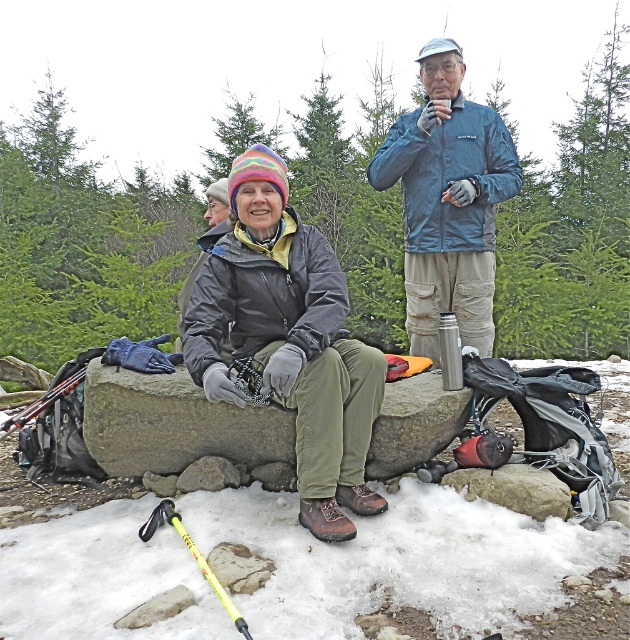
Question: Can you confirm if blue textured jacket at upper center is bigger than gray stone boulder at center?

Choices:
 (A) yes
 (B) no

Answer: (A)

Question: Which point is farther to the camera?

Choices:
 (A) blue textured jacket at upper center
 (B) gray stone boulder at center
 (C) matte black jacket at center

Answer: (A)

Question: From the image, what is the correct spatial relationship of matte black jacket at center in relation to blue textured jacket at upper center?

Choices:
 (A) left
 (B) right

Answer: (A)

Question: Which object is closer to the camera taking this photo?

Choices:
 (A) blue textured jacket at upper center
 (B) matte black jacket at center
 (C) gray stone boulder at center

Answer: (B)

Question: Which point is closer to the camera?

Choices:
 (A) (486, 166)
 (B) (459, 97)
 (C) (432, 372)

Answer: (C)

Question: Is matte black jacket at center to the left of blue textured jacket at upper center from the viewer's perspective?

Choices:
 (A) yes
 (B) no

Answer: (A)